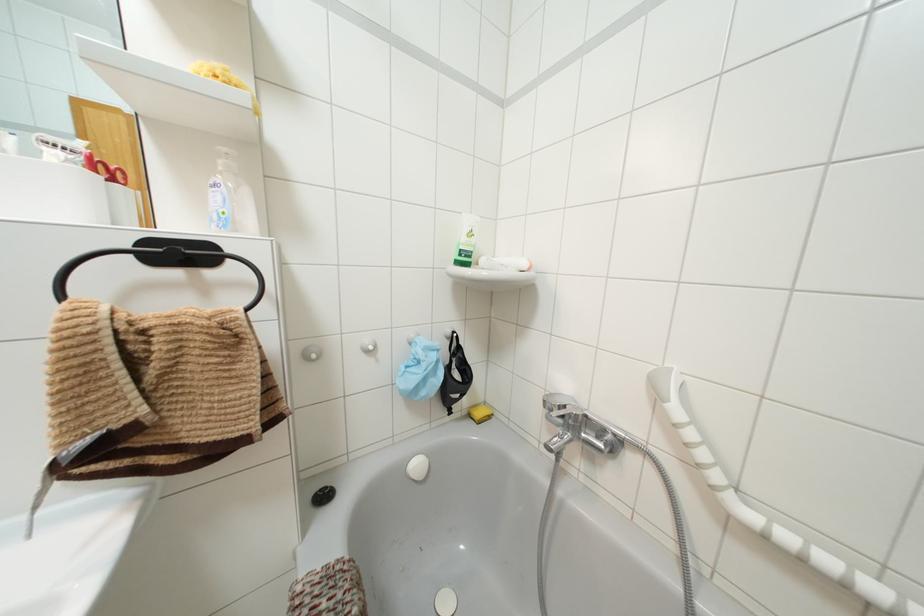
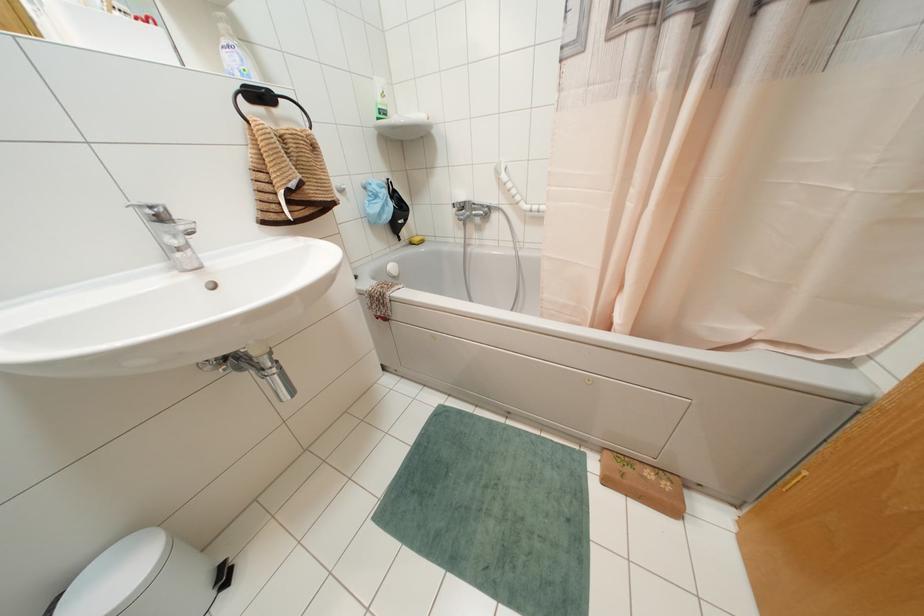
How did the camera likely rotate?

The camera's rotation is toward right-down.